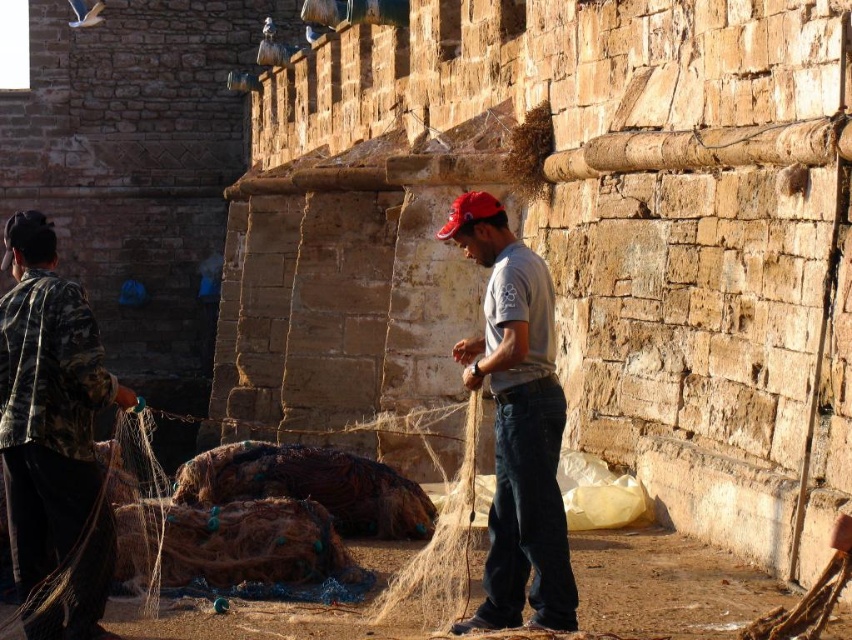
You are standing in front of the stone wall and see the camo fabric jacket at left and the red fabric baseball cap at center. Which object is positioned lower from the ground?

The camo fabric jacket at left is below the red fabric baseball cap at center, so the camo fabric jacket at left is positioned lower from the ground.